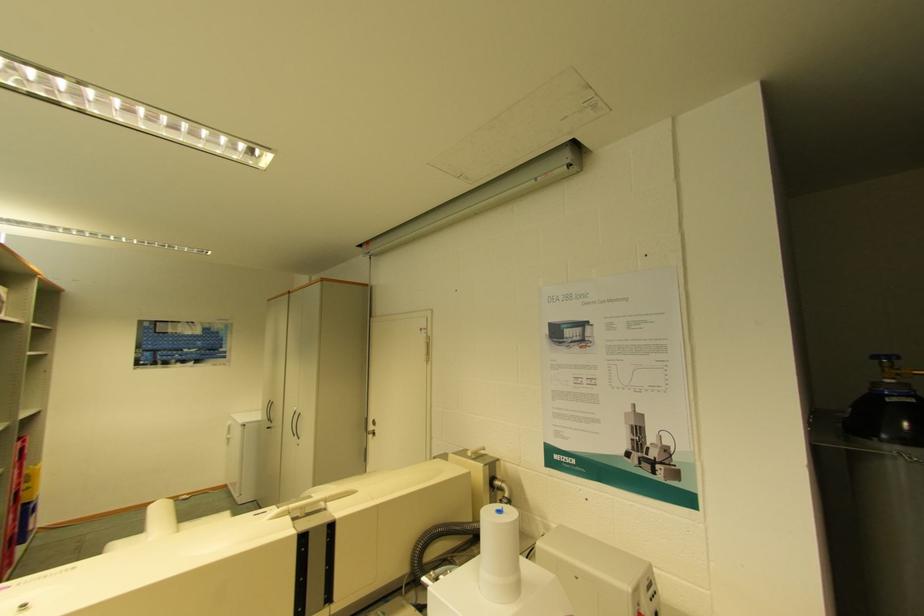
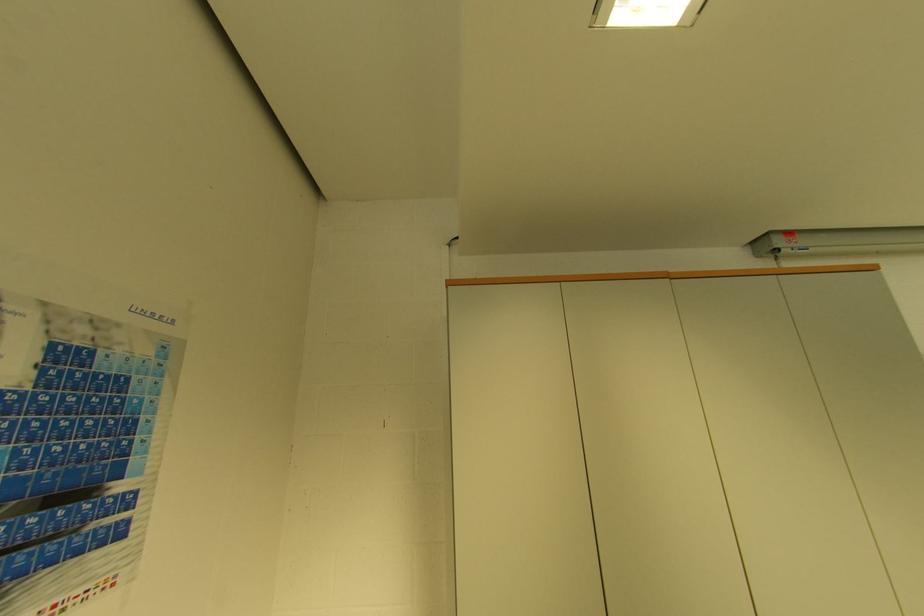
Find the pixel in the second image that matches pixel 228 358 in the first image.

(123, 533)